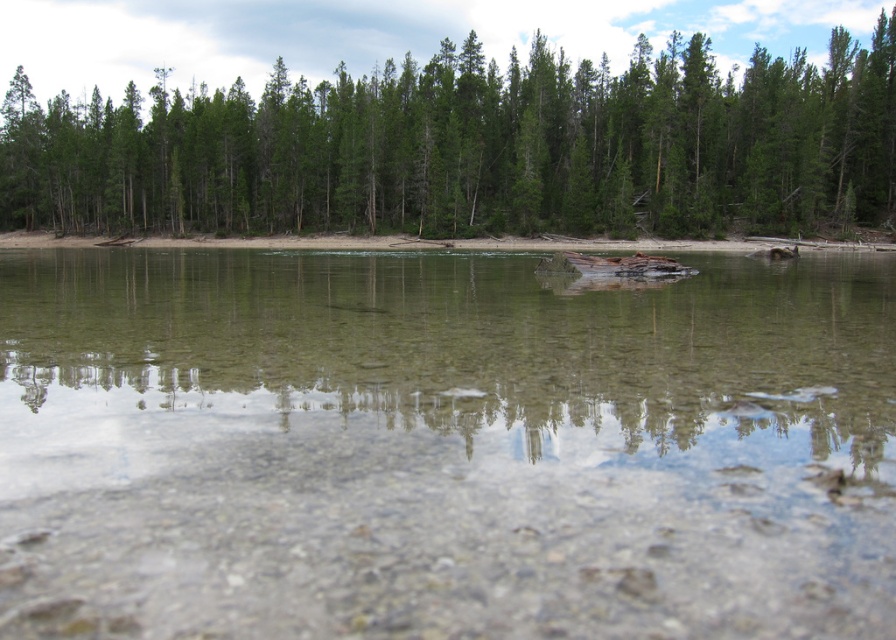
Question: Can you confirm if clear glass water at center is positioned to the right of green matte trees at upper center?

Choices:
 (A) yes
 (B) no

Answer: (A)

Question: Estimate the real-world distances between objects in this image. Which object is farther from the green matte trees at upper center?

Choices:
 (A) brown dirt shoreline at center
 (B) clear glass water at center

Answer: (B)

Question: Does green matte trees at upper center appear under brown dirt shoreline at center?

Choices:
 (A) no
 (B) yes

Answer: (A)

Question: Which point is farther to the camera?

Choices:
 (A) (59, 502)
 (B) (76, 125)

Answer: (B)

Question: Is clear glass water at center wider than green matte trees at upper center?

Choices:
 (A) no
 (B) yes

Answer: (A)

Question: Which point is farther to the camera?

Choices:
 (A) (755, 237)
 (B) (145, 406)

Answer: (A)